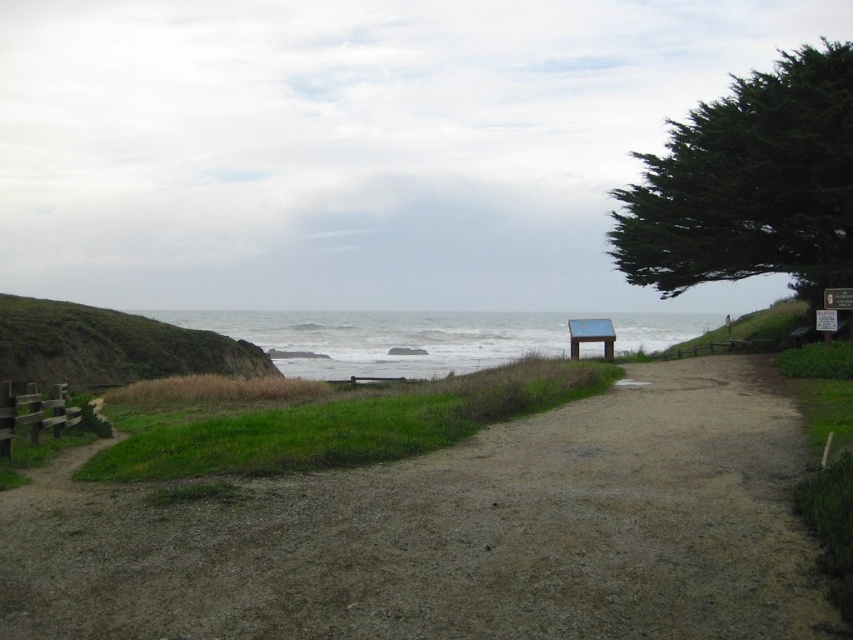
Between dirt path at center and wooden park bench at center, which one is positioned lower?

dirt path at center is below.

Image resolution: width=853 pixels, height=640 pixels. In order to click on dirt path at center in this screenshot , I will do `click(456, 534)`.

Does point (737, 276) lie in front of point (610, 349)?

No, it is not.

Is green leafy tree at upper right to the left of wooden park bench at center from the viewer's perspective?

Incorrect, green leafy tree at upper right is not on the left side of wooden park bench at center.

You are a GUI agent. You are given a task and a screenshot of the screen. Output one action in this format:
    pyautogui.click(x=<x>, y=<y>)
    Task: Click on the green leafy tree at upper right
    The image size is (853, 640).
    Given the screenshot: What is the action you would take?
    pyautogui.click(x=749, y=184)

The width and height of the screenshot is (853, 640). Identify the location of green leafy tree at upper right. (749, 184).

Between point (433, 625) and point (611, 240), which one is positioned in front?

Point (433, 625)

Who is more distant from viewer, (418,477) or (779,189)?

Positioned behind is point (779,189).

Locate an element on the screen. Image resolution: width=853 pixels, height=640 pixels. dirt path at center is located at coordinates (456, 534).